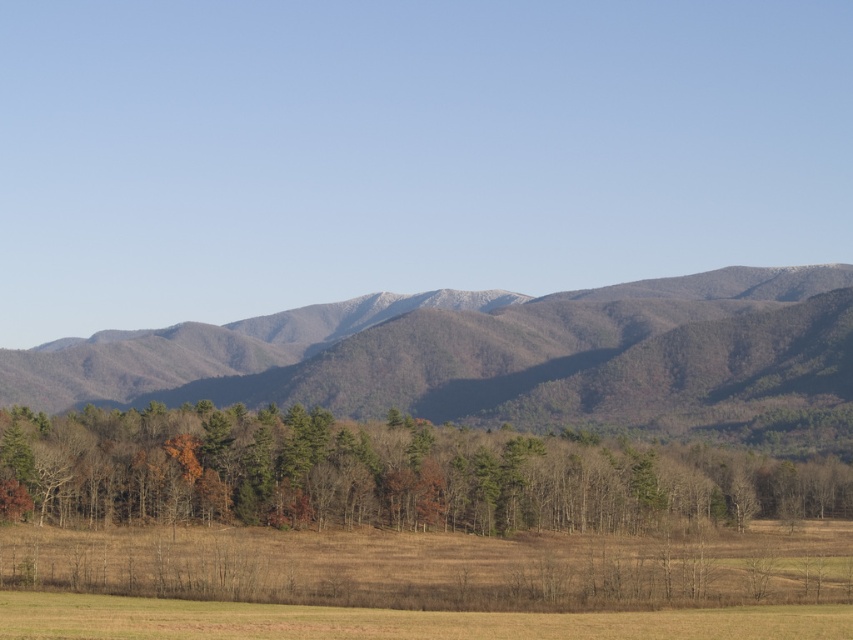
Is gray textured mountain range at center shorter than brown textured trees at center?

No, gray textured mountain range at center is not shorter than brown textured trees at center.

Locate an element on the screen. This screenshot has width=853, height=640. gray textured mountain range at center is located at coordinates (508, 358).

In the scene shown: Can you confirm if gray textured mountain range at center is thinner than brown grassland at lower center?

No, gray textured mountain range at center is not thinner than brown grassland at lower center.

What do you see at coordinates (508, 358) in the screenshot?
I see `gray textured mountain range at center` at bounding box center [508, 358].

Does point (821, 368) lie in front of point (38, 611)?

No, (821, 368) is behind (38, 611).

At what (x,y) coordinates should I click in order to perform the action: click on gray textured mountain range at center. Please return your answer as a coordinate pair (x, y). Looking at the image, I should click on (508, 358).

Does brown textured trees at center appear on the right side of brown grassland at lower center?

Yes, brown textured trees at center is to the right of brown grassland at lower center.

Which is below, brown textured trees at center or brown grassland at lower center?

Positioned lower is brown textured trees at center.

Which is in front, point (543, 445) or point (432, 612)?

Point (432, 612) is in front.

Locate an element on the screen. Image resolution: width=853 pixels, height=640 pixels. brown textured trees at center is located at coordinates (381, 474).